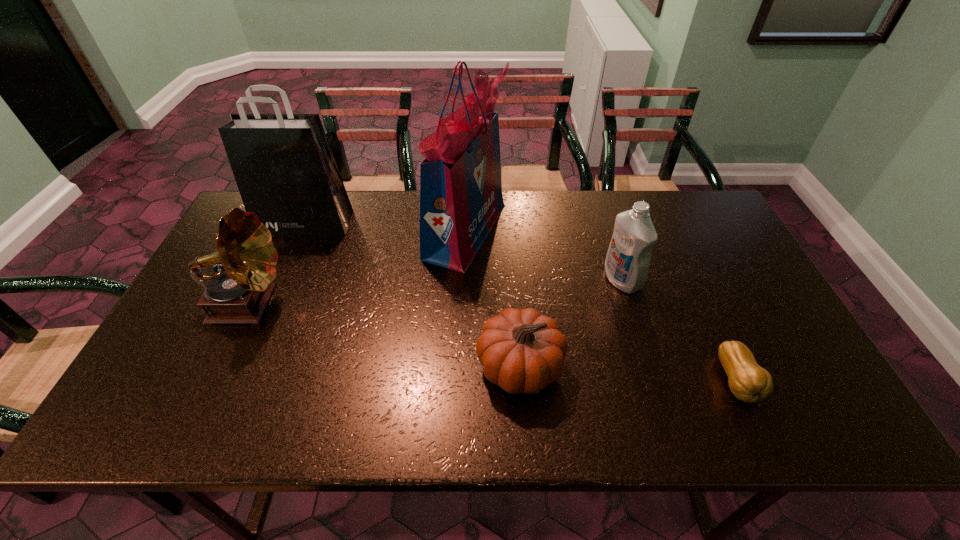
Find the location of a particular element. the tallest object is located at coordinates (461, 198).

At what (x,y) coordinates should I click in order to perform the action: click on the second tallest object. Please return your answer as a coordinate pair (x, y). The height and width of the screenshot is (540, 960). Looking at the image, I should click on (283, 165).

At what (x,y) coordinates should I click in order to perform the action: click on phonograph_record. Please return your answer as a coordinate pair (x, y). The width and height of the screenshot is (960, 540). Looking at the image, I should click on (246, 259).

At what (x,y) coordinates should I click in order to perform the action: click on the second object from right to left. Please return your answer as a coordinate pair (x, y). Looking at the image, I should click on (627, 262).

Locate an element on the screen. the fifth tallest object is located at coordinates (522, 351).

Identify the location of gourd. The width and height of the screenshot is (960, 540). (749, 382).

Locate an element on the screen. The width and height of the screenshot is (960, 540). the rightmost object is located at coordinates (749, 382).

Where is `free region located 0.370m on the front-facing side of the grocery bag`? This screenshot has width=960, height=540. free region located 0.370m on the front-facing side of the grocery bag is located at coordinates (624, 231).

The height and width of the screenshot is (540, 960). In order to click on vacant space located 0.150m on the front with handles of the fifth shortest object in this screenshot , I will do `click(285, 269)`.

You are a GUI agent. You are given a task and a screenshot of the screen. Output one action in this format:
    pyautogui.click(x=<x>, y=<y>)
    Task: Click on the vacant area located on the horn of the phonograph_record
    The width and height of the screenshot is (960, 540).
    Given the screenshot: What is the action you would take?
    pyautogui.click(x=335, y=304)